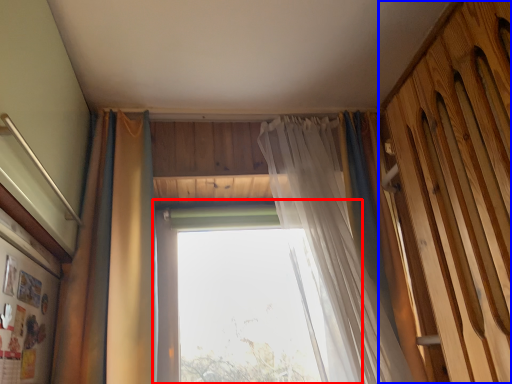
Question: Which point is further to the camera, window (highlighted by a red box) or barn door (highlighted by a blue box)?

Choices:
 (A) window
 (B) barn door

Answer: (A)